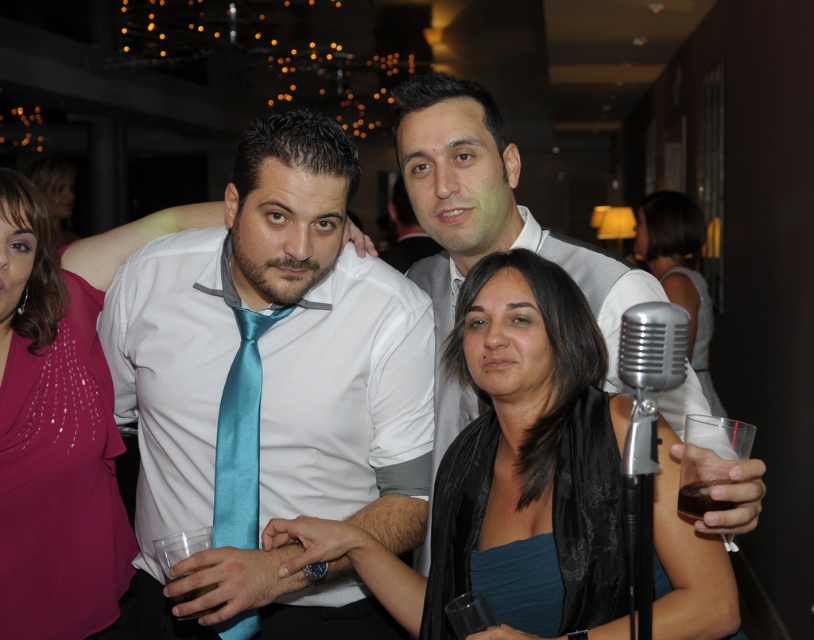
Question: Which point is farther from the camera taking this photo?

Choices:
 (A) (749, 449)
 (B) (672, 362)
 (C) (696, 320)
 (D) (62, 531)

Answer: (C)

Question: Does teal satin scarf at center have a lesser width compared to shiny pink blouse at center?

Choices:
 (A) no
 (B) yes

Answer: (A)

Question: Can you confirm if satin blue tie at center is thinner than teal satin scarf at center?

Choices:
 (A) yes
 (B) no

Answer: (A)

Question: Considering the real-world distances, which object is farthest from the shiny pink blouse at center?

Choices:
 (A) teal satin tie at center
 (B) transparent plastic wine glass at lower right
 (C) teal satin scarf at center

Answer: (B)

Question: Based on their relative distances, which object is farther from the teal satin tie at center?

Choices:
 (A) silver metallic microphone at center-right
 (B) shiny pink blouse at center

Answer: (A)

Question: Is shiny pink blouse at center bigger than silver metallic microphone at center-right?

Choices:
 (A) no
 (B) yes

Answer: (B)